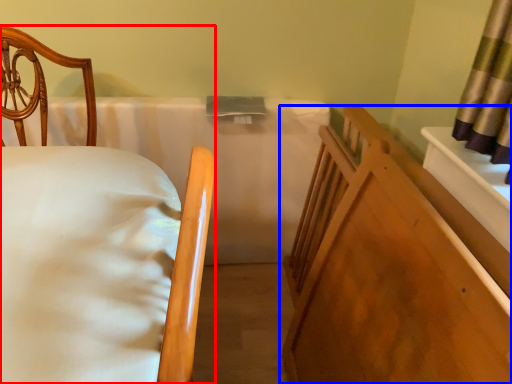
Question: Among these objects, which one is nearest to the camera, bed (highlighted by a red box) or furniture (highlighted by a blue box)?

Choices:
 (A) bed
 (B) furniture

Answer: (A)